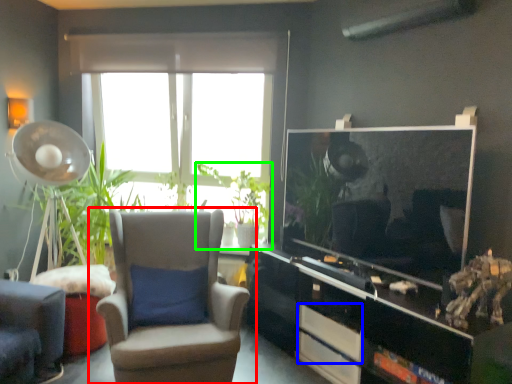
Question: Which object is positioned closest to chair (highlighted by a red box)? Select from drawer (highlighted by a blue box) and houseplant (highlighted by a green box).

Choices:
 (A) drawer
 (B) houseplant

Answer: (A)